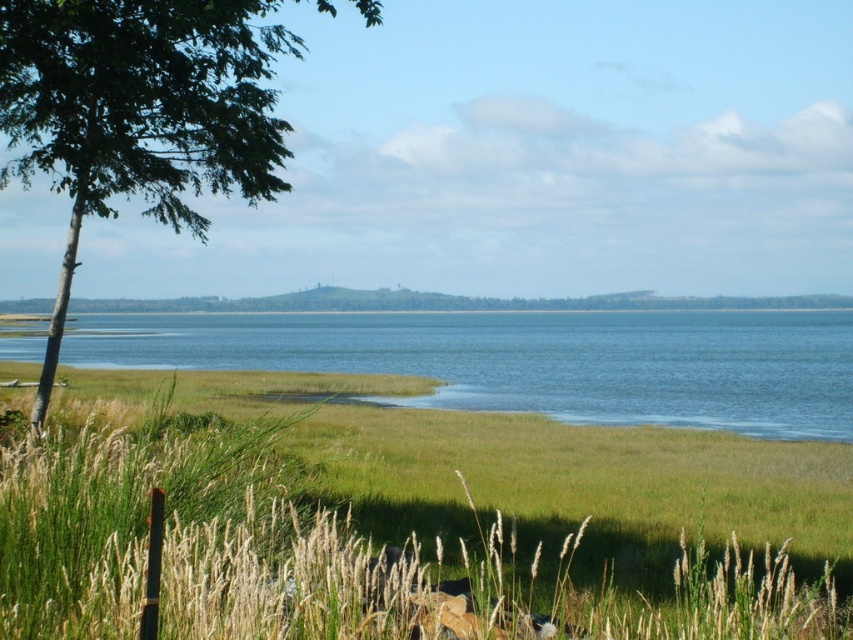
Locate an element on the screen. This screenshot has width=853, height=640. green grassy at lower center is located at coordinates (405, 518).

Between green grassy at lower center and green leafy tree at left, which one appears on the right side from the viewer's perspective?

Positioned to the right is green grassy at lower center.

This screenshot has width=853, height=640. What are the coordinates of `green grassy at lower center` in the screenshot? It's located at (405, 518).

From the picture: Between green grassy at lower center and blue water at center, which one is positioned higher?

blue water at center is higher up.

Does green grassy at lower center have a smaller size compared to blue water at center?

Yes, green grassy at lower center is smaller than blue water at center.

Is point (842, 582) farther from viewer compared to point (538, 337)?

No, (842, 582) is closer to viewer.

Locate an element on the screen. This screenshot has width=853, height=640. green grassy at lower center is located at coordinates (405, 518).

Does blue water at center have a smaller size compared to green leafy tree at left?

Yes.

Does blue water at center appear on the left side of green leafy tree at left?

In fact, blue water at center is to the right of green leafy tree at left.

This screenshot has width=853, height=640. Identify the location of blue water at center. coord(531,360).